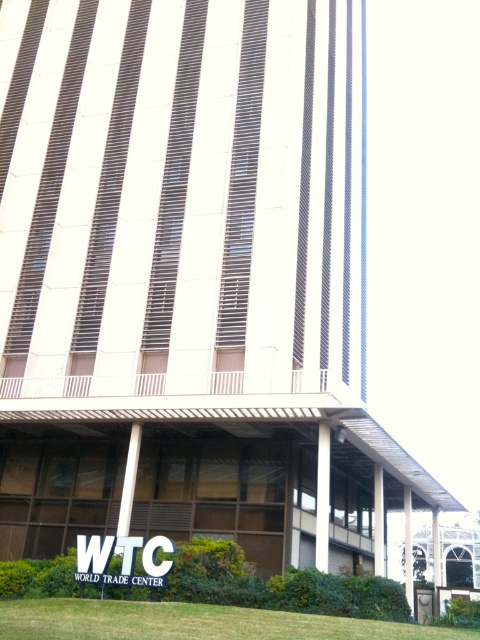
This screenshot has height=640, width=480. Describe the element at coordinates (192, 621) in the screenshot. I see `green grass at lower center` at that location.

Between green grass at lower center and white plastic sign at center, which one has less height?

Standing shorter between the two is white plastic sign at center.

This screenshot has width=480, height=640. Identify the location of green grass at lower center. (192, 621).